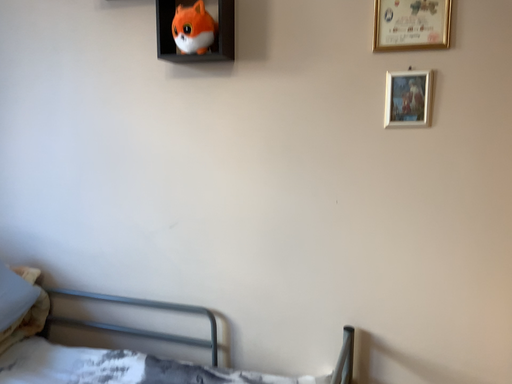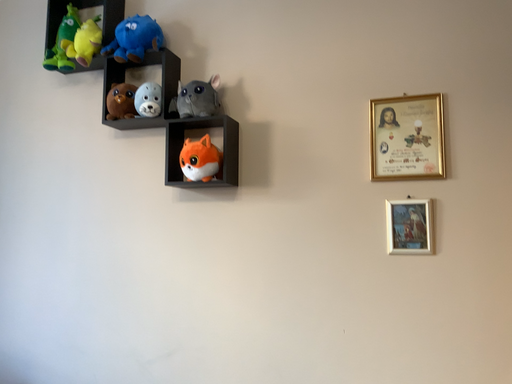
Question: How did the camera likely rotate when shooting the video?

Choices:
 (A) rotated upward
 (B) rotated downward

Answer: (A)